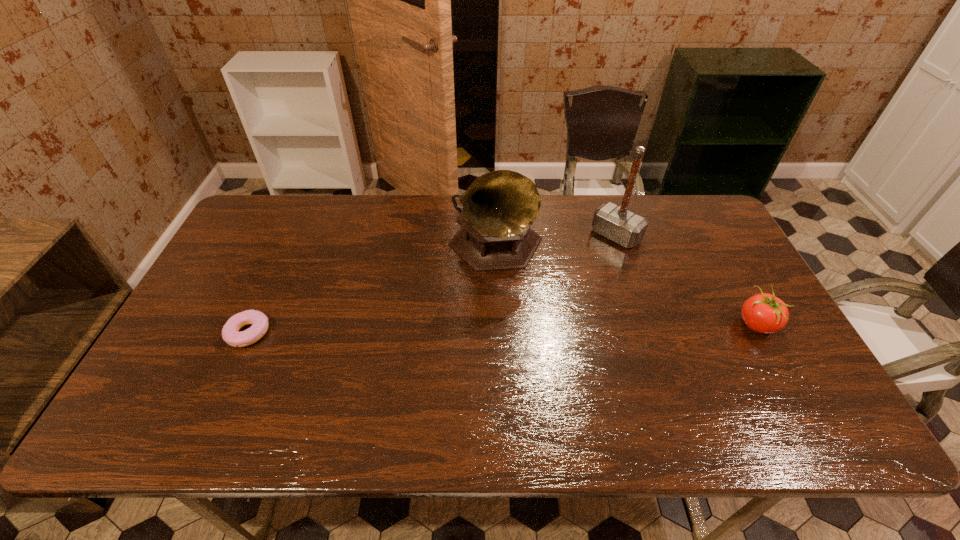
The width and height of the screenshot is (960, 540). Find the location of `free space on the desktop that is between the doughnut and the rightmost object and is positioned on the horn direction of the phonograph record`. free space on the desktop that is between the doughnut and the rightmost object and is positioned on the horn direction of the phonograph record is located at coordinates (580, 328).

Where is `free space on the desktop that is between the leftmost object and the third tallest object and is positioned on the striking surface of the second object from right to left`? The width and height of the screenshot is (960, 540). free space on the desktop that is between the leftmost object and the third tallest object and is positioned on the striking surface of the second object from right to left is located at coordinates (514, 329).